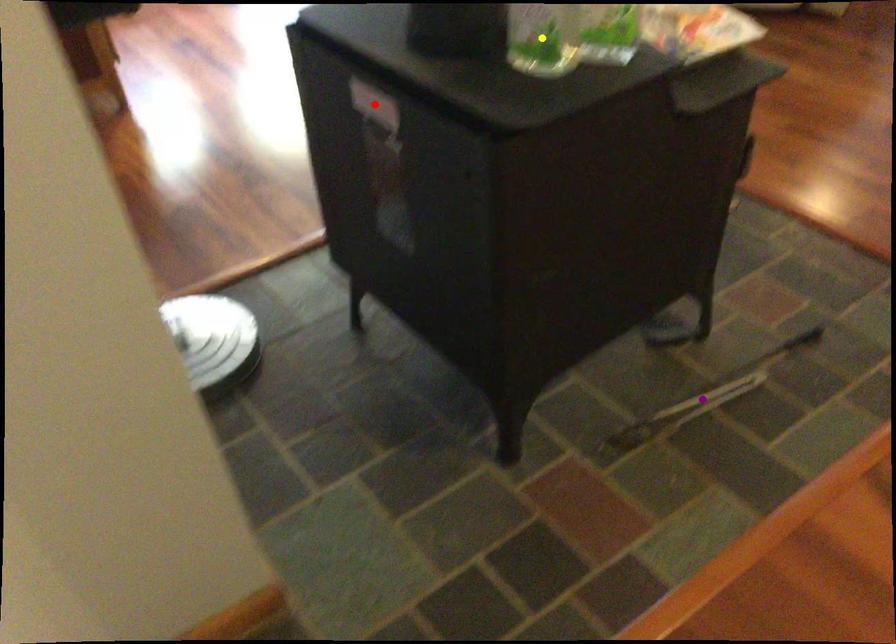
Order these from nearest to farthest:
red point, purple point, yellow point

purple point, red point, yellow point